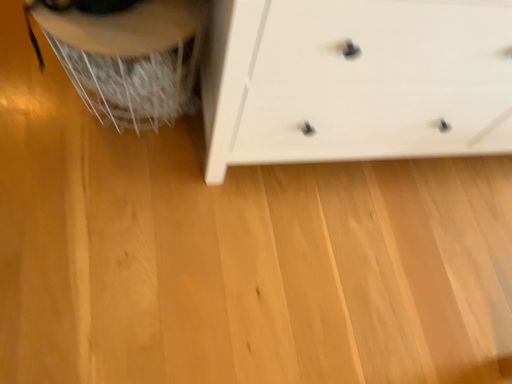
Find the location of `free space between white matte chest of drawers at center and white plastic swivel chair at left`. free space between white matte chest of drawers at center and white plastic swivel chair at left is located at coordinates (143, 172).